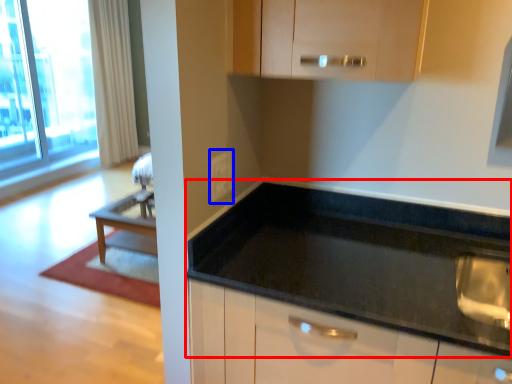
Question: Which point is closer to the camera, countertop (highlighted by a red box) or electric outlet (highlighted by a blue box)?

Choices:
 (A) countertop
 (B) electric outlet

Answer: (A)